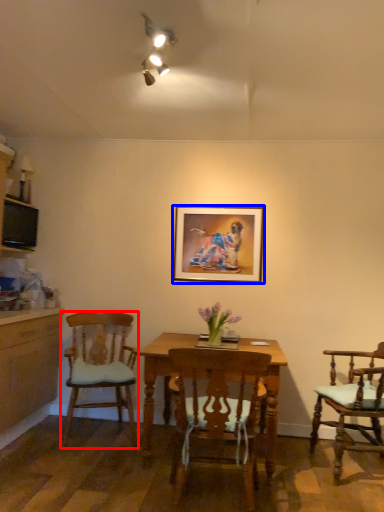
Question: Which object is closer to the camera taking this photo, chair (highlighted by a red box) or picture frame (highlighted by a blue box)?

Choices:
 (A) chair
 (B) picture frame

Answer: (A)